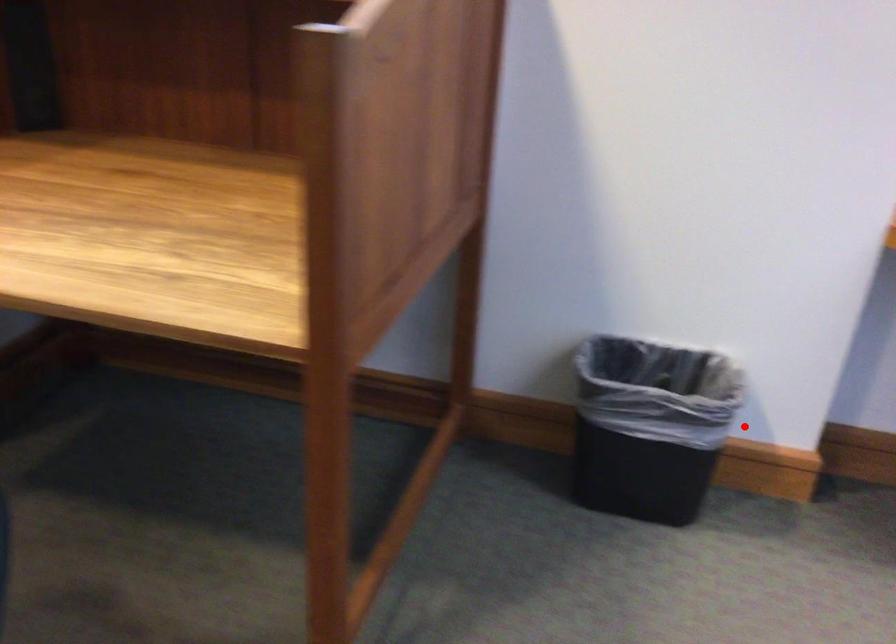
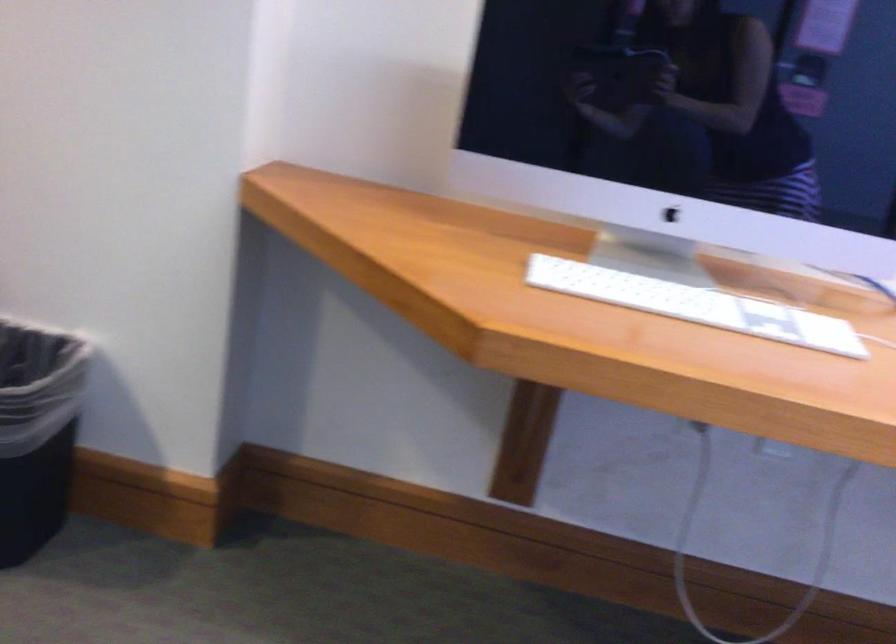
Find the pixel in the second image that matches the highlighted location in the first image.

(37, 431)